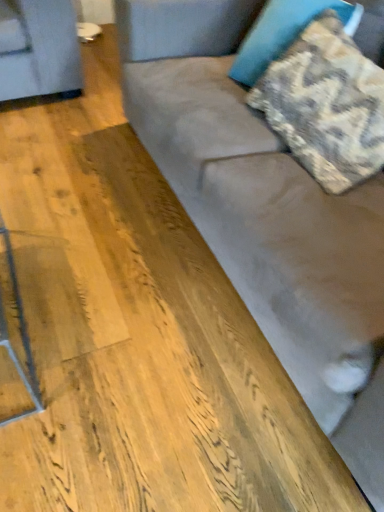
Locate an element on the screen. The height and width of the screenshot is (512, 384). camouflage fabric pillow at upper right, which is the second pillow from bottom to top is located at coordinates (284, 33).

How much space does camouflage fabric pillow at upper right, which appears as the first pillow when viewed from the top, occupy vertically?

camouflage fabric pillow at upper right, which appears as the first pillow when viewed from the top, is 15.81 inches tall.

What is the approximate width of textured beige pillow at upper right, which is the 1th pillow in bottom-to-top order?

The width of textured beige pillow at upper right, which is the 1th pillow in bottom-to-top order, is 32.06 centimeters.

The height and width of the screenshot is (512, 384). What do you see at coordinates (262, 209) in the screenshot?
I see `suede couch at center` at bounding box center [262, 209].

In order to click on camouflage fabric pillow at upper right, which is the second pillow from bottom to top in this screenshot , I will do `click(284, 33)`.

Is suede couch at center in front of or behind camouflage fabric pillow at upper right, which is the second pillow from bottom to top, in the image?

Visually, suede couch at center is located in front of camouflage fabric pillow at upper right, which is the second pillow from bottom to top.

Which is less distant, (307, 280) or (237, 57)?

Point (307, 280) appears to be closer to the viewer than point (237, 57).

Which of these two, suede couch at center or camouflage fabric pillow at upper right, which appears as the first pillow when viewed from the top, is smaller?

camouflage fabric pillow at upper right, which appears as the first pillow when viewed from the top.

Could you tell me if suede couch at center is turned towards camouflage fabric pillow at upper right, which appears as the first pillow when viewed from the top?

No, suede couch at center is not facing towards camouflage fabric pillow at upper right, which appears as the first pillow when viewed from the top.

Who is taller, textured beige pillow at upper right, positioned as the 2th pillow in top-to-bottom order, or camouflage fabric pillow at upper right, which is the second pillow from bottom to top?

With more height is camouflage fabric pillow at upper right, which is the second pillow from bottom to top.

From the image's perspective, is textured beige pillow at upper right, which is the 1th pillow in bottom-to-top order, on top of camouflage fabric pillow at upper right, which is the second pillow from bottom to top?

Actually, textured beige pillow at upper right, which is the 1th pillow in bottom-to-top order, appears below camouflage fabric pillow at upper right, which is the second pillow from bottom to top, in the image.

In the scene shown: Is the position of textured beige pillow at upper right, which is the 1th pillow in bottom-to-top order, more distant than that of camouflage fabric pillow at upper right, which is the second pillow from bottom to top?

No, it is in front of camouflage fabric pillow at upper right, which is the second pillow from bottom to top.

From a real-world perspective, is textured beige pillow at upper right, positioned as the 2th pillow in top-to-bottom order, positioned above or below camouflage fabric pillow at upper right, which is the second pillow from bottom to top?

From a real-world perspective, textured beige pillow at upper right, positioned as the 2th pillow in top-to-bottom order, is physically below camouflage fabric pillow at upper right, which is the second pillow from bottom to top.

Which is in front, point (323, 140) or point (301, 271)?

The point (301, 271) is closer.

Looking at their sizes, would you say textured beige pillow at upper right, which is the 1th pillow in bottom-to-top order, is wider or thinner than suede couch at center?

Clearly, textured beige pillow at upper right, which is the 1th pillow in bottom-to-top order, has less width compared to suede couch at center.

Could you tell me if textured beige pillow at upper right, which is the 1th pillow in bottom-to-top order, is turned towards suede couch at center?

Yes.

Considering the points (223, 238) and (312, 146), which point is in front, point (223, 238) or point (312, 146)?

Point (312, 146)

Who is smaller, suede couch at center or textured beige pillow at upper right, positioned as the 2th pillow in top-to-bottom order?

Smaller between the two is textured beige pillow at upper right, positioned as the 2th pillow in top-to-bottom order.

Is there a large distance between suede couch at center and textured beige pillow at upper right, which is the 1th pillow in bottom-to-top order?

No, suede couch at center is not far from textured beige pillow at upper right, which is the 1th pillow in bottom-to-top order.

Find the location of `the 1st pillow counting from the left side of the suede couch at center`. the 1st pillow counting from the left side of the suede couch at center is located at coordinates (326, 105).

What are the coordinates of `the 2nd pillow behind the suede couch at center` in the screenshot? It's located at (284, 33).

Can you tell me how much camouflage fabric pillow at upper right, which is the second pillow from bottom to top, and suede couch at center differ in facing direction?

The facing directions of camouflage fabric pillow at upper right, which is the second pillow from bottom to top, and suede couch at center are 86.8 degrees apart.

Is camouflage fabric pillow at upper right, which appears as the first pillow when viewed from the top, to the left or to the right of suede couch at center in the image?

camouflage fabric pillow at upper right, which appears as the first pillow when viewed from the top, is to the left of suede couch at center.

Considering the relative sizes of camouflage fabric pillow at upper right, which is the second pillow from bottom to top, and suede couch at center in the image provided, is camouflage fabric pillow at upper right, which is the second pillow from bottom to top, smaller than suede couch at center?

Indeed, camouflage fabric pillow at upper right, which is the second pillow from bottom to top, has a smaller size compared to suede couch at center.

Measure the distance from camouflage fabric pillow at upper right, which appears as the first pillow when viewed from the top, to textured beige pillow at upper right, positioned as the 2th pillow in top-to-bottom order.

9.01 inches.

Is camouflage fabric pillow at upper right, which appears as the first pillow when viewed from the top, bigger or smaller than textured beige pillow at upper right, positioned as the 2th pillow in top-to-bottom order?

Considering their sizes, camouflage fabric pillow at upper right, which appears as the first pillow when viewed from the top, takes up less space than textured beige pillow at upper right, positioned as the 2th pillow in top-to-bottom order.

Is point (288, 3) closer or farther from the camera than point (344, 40)?

Point (288, 3) is farther from the camera than point (344, 40).

Where is `the 2nd pillow directly above the suede couch at center (from a real-world perspective)`? the 2nd pillow directly above the suede couch at center (from a real-world perspective) is located at coordinates (284, 33).

I want to click on pillow that is behind the textured beige pillow at upper right, positioned as the 2th pillow in top-to-bottom order, so [284, 33].

Looking at the image, which one is located further to textured beige pillow at upper right, which is the 1th pillow in bottom-to-top order, suede couch at center or camouflage fabric pillow at upper right, which is the second pillow from bottom to top?

suede couch at center.

Looking at the image, which one is located closer to camouflage fabric pillow at upper right, which appears as the first pillow when viewed from the top, suede couch at center or textured beige pillow at upper right, which is the 1th pillow in bottom-to-top order?

Based on the image, textured beige pillow at upper right, which is the 1th pillow in bottom-to-top order, appears to be nearer to camouflage fabric pillow at upper right, which appears as the first pillow when viewed from the top.

Estimate the real-world distances between objects in this image. Which object is closer to suede couch at center, textured beige pillow at upper right, which is the 1th pillow in bottom-to-top order, or camouflage fabric pillow at upper right, which is the second pillow from bottom to top?

Among the two, textured beige pillow at upper right, which is the 1th pillow in bottom-to-top order, is located nearer to suede couch at center.

From the image, which object appears to be farther from camouflage fabric pillow at upper right, which is the second pillow from bottom to top, textured beige pillow at upper right, positioned as the 2th pillow in top-to-bottom order, or suede couch at center?

The object further to camouflage fabric pillow at upper right, which is the second pillow from bottom to top, is suede couch at center.

Based on the photo, estimate the real-world distances between objects in this image. Which object is closer to textured beige pillow at upper right, which is the 1th pillow in bottom-to-top order, camouflage fabric pillow at upper right, which appears as the first pillow when viewed from the top, or suede couch at center?

Among the two, camouflage fabric pillow at upper right, which appears as the first pillow when viewed from the top, is located nearer to textured beige pillow at upper right, which is the 1th pillow in bottom-to-top order.

Estimate the real-world distances between objects in this image. Which object is closer to suede couch at center, camouflage fabric pillow at upper right, which appears as the first pillow when viewed from the top, or textured beige pillow at upper right, which is the 1th pillow in bottom-to-top order?

The object closer to suede couch at center is textured beige pillow at upper right, which is the 1th pillow in bottom-to-top order.

Identify the location of pillow between suede couch at center and camouflage fabric pillow at upper right, which appears as the first pillow when viewed from the top, along the z-axis. The height and width of the screenshot is (512, 384). (326, 105).